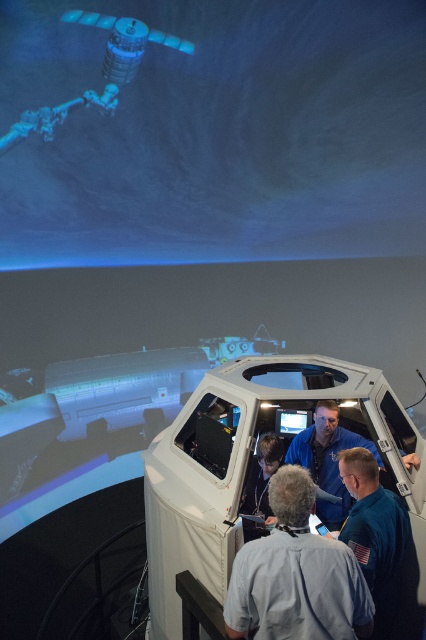
Is blue uniform at center above matte black monitor at center?

Actually, blue uniform at center is below matte black monitor at center.

Can you confirm if blue uniform at center is positioned to the right of matte black monitor at center?

In fact, blue uniform at center is to the left of matte black monitor at center.

The width and height of the screenshot is (426, 640). Find the location of `blue uniform at center`. blue uniform at center is located at coordinates (296, 576).

How far apart are blue uniform at center and blue fabric shirt at center?

They are 1.20 meters apart.

Does blue uniform at center have a smaller size compared to blue fabric shirt at center?

Yes.

Which is behind, point (356, 621) or point (342, 506)?

The point (342, 506) is behind.

At what (x,y) coordinates should I click in order to perform the action: click on blue uniform at center. Please return your answer as a coordinate pair (x, y). The width and height of the screenshot is (426, 640). Looking at the image, I should click on (296, 576).

Does blue fabric astronaut at lower right lie in front of matte black monitor at center?

That is True.

Between blue fabric astronaut at lower right and matte black monitor at center, which one appears on the left side from the viewer's perspective?

matte black monitor at center is more to the left.

You are a GUI agent. You are given a task and a screenshot of the screen. Output one action in this format:
    pyautogui.click(x=<x>, y=<y>)
    Task: Click on the blue fabric astronaut at lower right
    
    Given the screenshot: What is the action you would take?
    pyautogui.click(x=379, y=538)

Find the location of `blue fabric astronaut at lower right`. blue fabric astronaut at lower right is located at coordinates (379, 538).